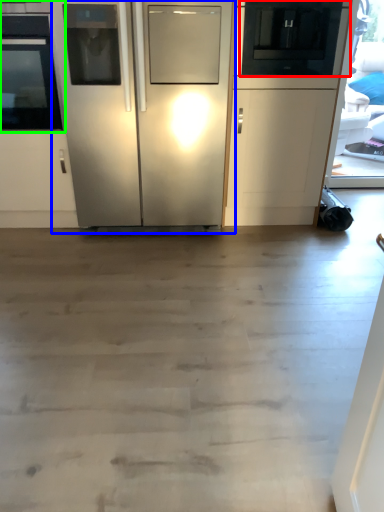
Question: Which is farther away from appliance (highlighted by a red box)? refrigerator (highlighted by a blue box) or oven (highlighted by a green box)?

Choices:
 (A) refrigerator
 (B) oven

Answer: (B)